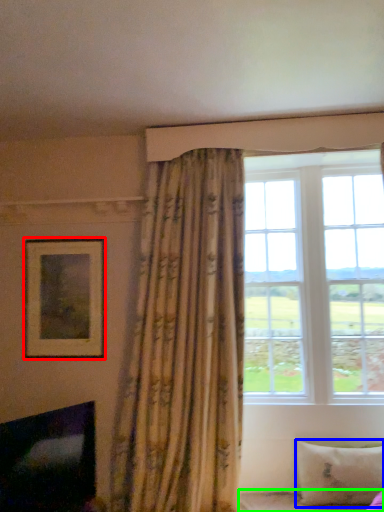
Question: Considering the real-world distances, which object is farthest from picture frame (highlighted by a red box)? pillow (highlighted by a blue box) or bed frame (highlighted by a green box)?

Choices:
 (A) pillow
 (B) bed frame

Answer: (A)